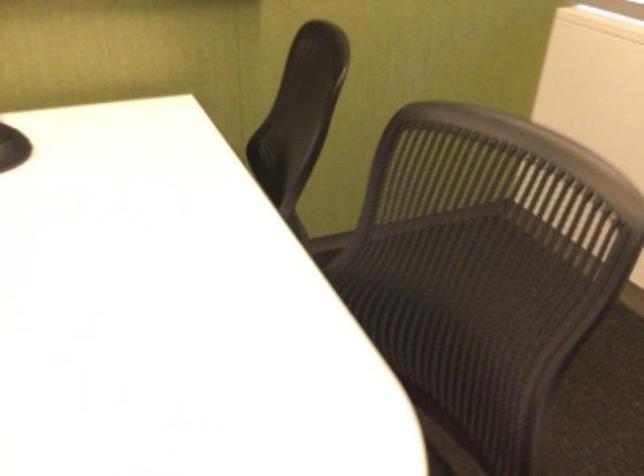
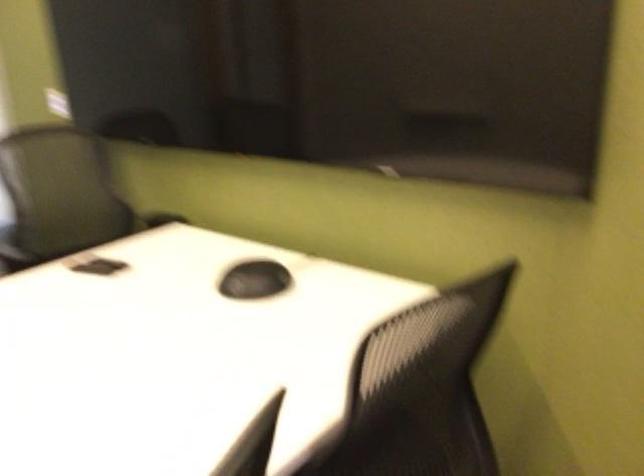
Question: The images are taken continuously from a first-person perspective. In which direction is your viewpoint rotating?

Choices:
 (A) Left
 (B) Right
 (C) Up
 (D) Down

Answer: (A)